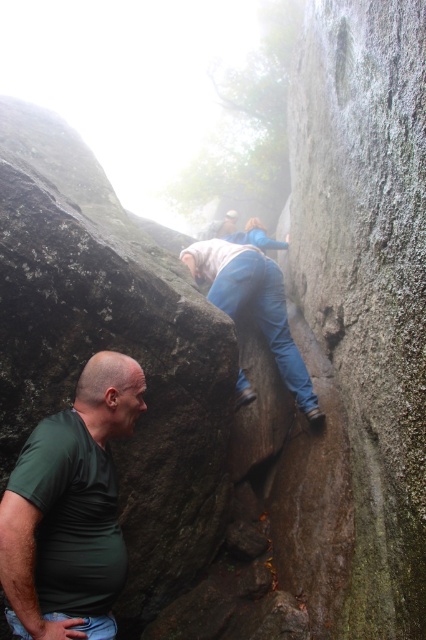
Question: Can you confirm if green matte shirt at lower left is smaller than blue jeans at center?

Choices:
 (A) no
 (B) yes

Answer: (B)

Question: Which point is farther to the camera?

Choices:
 (A) (218, 292)
 (B) (68, 593)

Answer: (A)

Question: Which of the following is the farthest from the observer?

Choices:
 (A) blue jeans at center
 (B) green matte shirt at lower left

Answer: (A)

Question: Where is green matte shirt at lower left located in relation to blue jeans at center in the image?

Choices:
 (A) right
 (B) left

Answer: (B)

Question: In this image, where is green matte shirt at lower left located relative to blue jeans at center?

Choices:
 (A) left
 (B) right

Answer: (A)